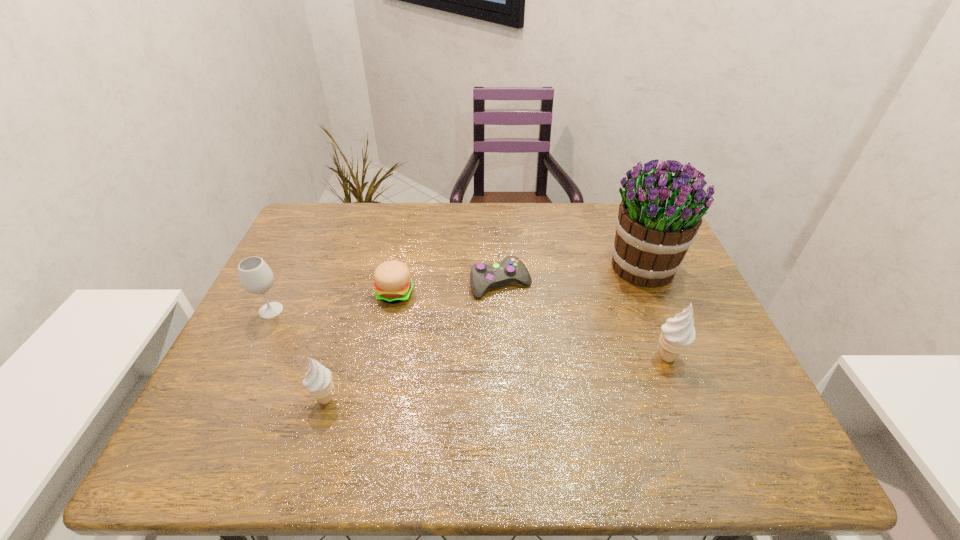
The height and width of the screenshot is (540, 960). I want to click on free space between the third object from left to right and the control, so click(x=448, y=288).

Identify the location of vacant region between the second object from left to right and the third object from right to left. (413, 342).

Identify the location of free space that is in between the tallest object and the control. (572, 276).

Identify the location of free point between the third object from left to right and the right icecream. This screenshot has height=540, width=960. (531, 325).

Where is `vacant space that's between the farther icecream and the bouquet`? vacant space that's between the farther icecream and the bouquet is located at coordinates (656, 313).

Identify the location of free space that is in between the nearer icecream and the wineglass. This screenshot has width=960, height=540. (299, 355).

Locate an element on the screen. The image size is (960, 540). vacant area between the second object from left to right and the wineglass is located at coordinates (299, 355).

The image size is (960, 540). What are the coordinates of `free spot between the third object from right to left and the nearer icecream` in the screenshot? It's located at (413, 342).

Select which object is the second closest to the taller icecream. Please provide its 2D coordinates. Your answer should be formatted as a tuple, i.e. [(x, y)], where the tuple contains the x and y coordinates of a point satisfying the conditions above.

[(482, 276)]

Locate which object is the third closest to the leftmost object. Please provide its 2D coordinates. Your answer should be formatted as a tuple, i.e. [(x, y)], where the tuple contains the x and y coordinates of a point satisfying the conditions above.

[(482, 276)]